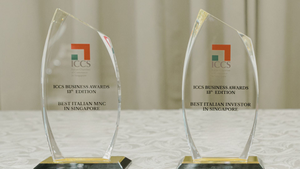
Find the location of `curtain`. curtain is located at coordinates (280, 59).